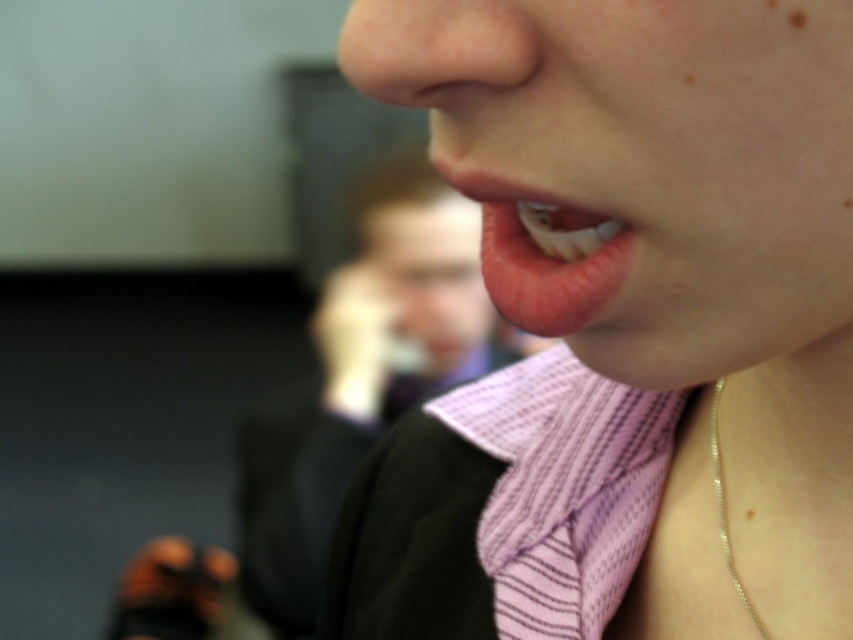
Question: Does pink striped shirt at center have a larger size compared to pink glossy lips at center?

Choices:
 (A) yes
 (B) no

Answer: (A)

Question: Which of the following is the farthest from the observer?

Choices:
 (A) (758, 628)
 (B) (556, 264)
 (C) (340, 371)
 (D) (805, 13)

Answer: (C)

Question: Considering the real-world distances, which object is farthest from the brown matte freckle at upper right?

Choices:
 (A) pink striped shirt at center
 (B) pink glossy lips at center
 (C) gold chain at lower right

Answer: (A)

Question: In this image, where is gold chain at lower right located relative to brown matte freckle at upper right?

Choices:
 (A) right
 (B) left

Answer: (A)

Question: Which point is farther to the camera?

Choices:
 (A) (358, 282)
 (B) (498, 220)
 (C) (790, 20)

Answer: (A)

Question: Can you confirm if pink striped shirt at center is thinner than brown matte freckle at upper right?

Choices:
 (A) no
 (B) yes

Answer: (A)